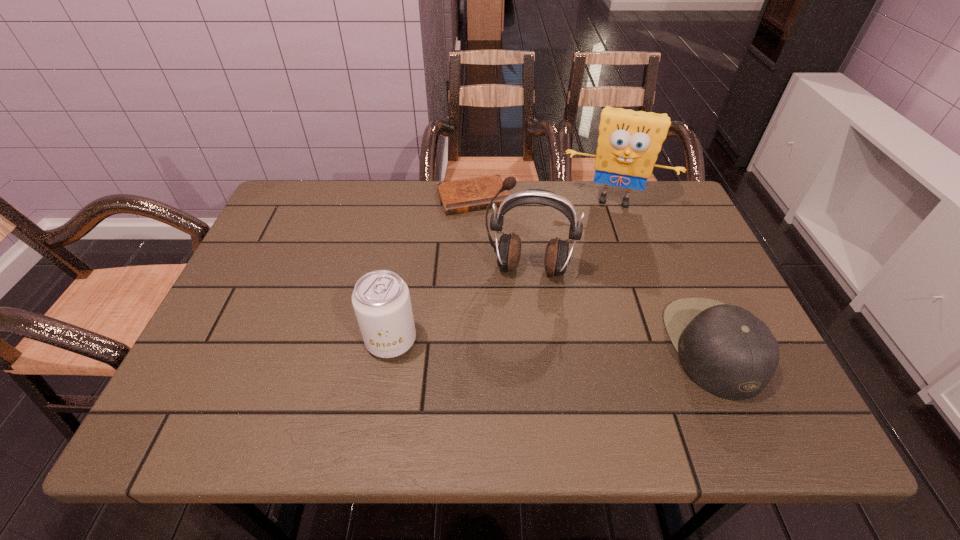
I want to click on free space between the cap and the shortest object, so click(x=593, y=272).

What are the coordinates of `vacant point located between the earphone and the third tallest object` in the screenshot? It's located at (460, 304).

Where is `unoccupied position between the sponge and the cap`? Image resolution: width=960 pixels, height=540 pixels. unoccupied position between the sponge and the cap is located at coordinates (663, 273).

The image size is (960, 540). Identify the location of empty space that is in between the cap and the sponge. (663, 273).

The width and height of the screenshot is (960, 540). I want to click on free space between the third nearest object and the third shortest object, so (460, 304).

Find the location of `vacant area that lies between the cap and the leftmost object`. vacant area that lies between the cap and the leftmost object is located at coordinates (552, 343).

Where is `empty space between the fourth tallest object and the earphone`? empty space between the fourth tallest object and the earphone is located at coordinates (621, 307).

You are a GUI agent. You are given a task and a screenshot of the screen. Output one action in this format:
    pyautogui.click(x=<x>, y=<y>)
    Task: Click on the free space between the fourth tallest object and the sponge
    The image size is (960, 540).
    Given the screenshot: What is the action you would take?
    pyautogui.click(x=663, y=273)

Identify the location of free space between the sponge and the leftmost object. pyautogui.click(x=502, y=269).

This screenshot has width=960, height=540. Find the location of `vacant area that lies between the soda can and the sponge`. vacant area that lies between the soda can and the sponge is located at coordinates (502, 269).